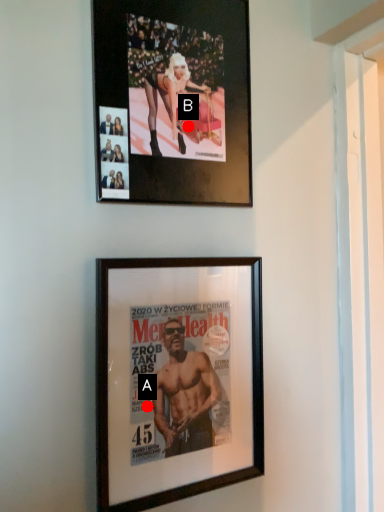
Question: Two points are circled on the image, labeled by A and B beside each circle. Which point is farther from the camera taking this photo?

Choices:
 (A) A is further
 (B) B is further

Answer: (B)